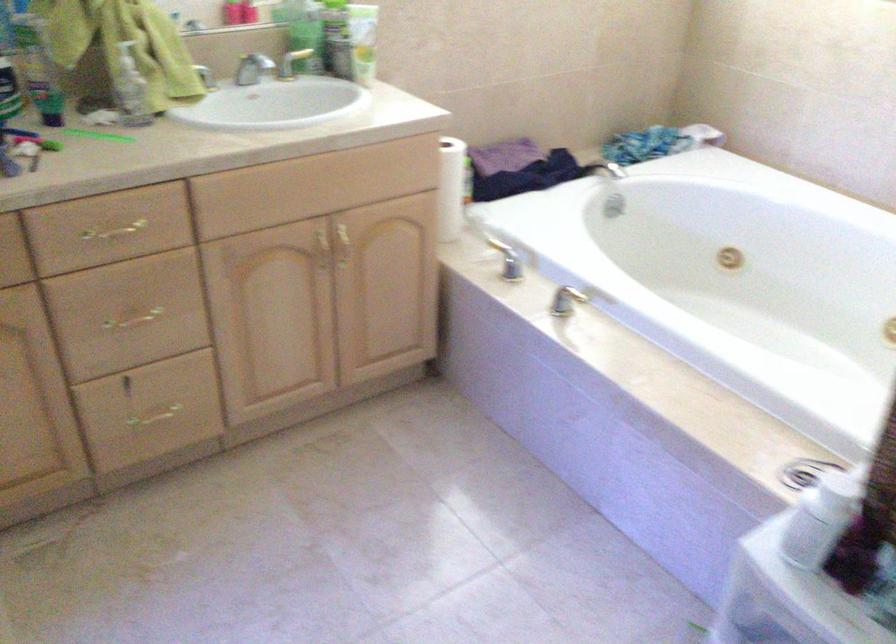
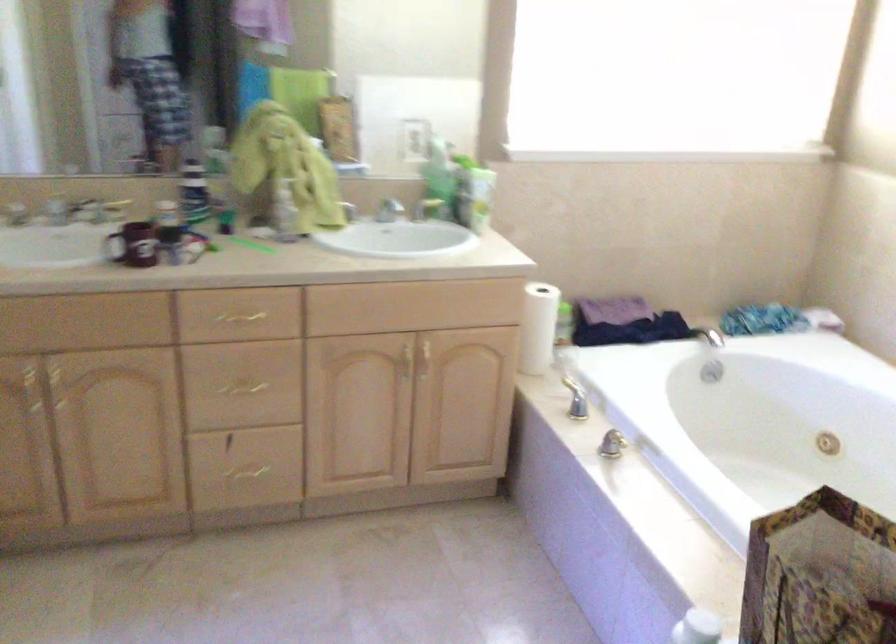
Find the pixel in the second image that matches pixel 504 263 in the first image.

(575, 399)